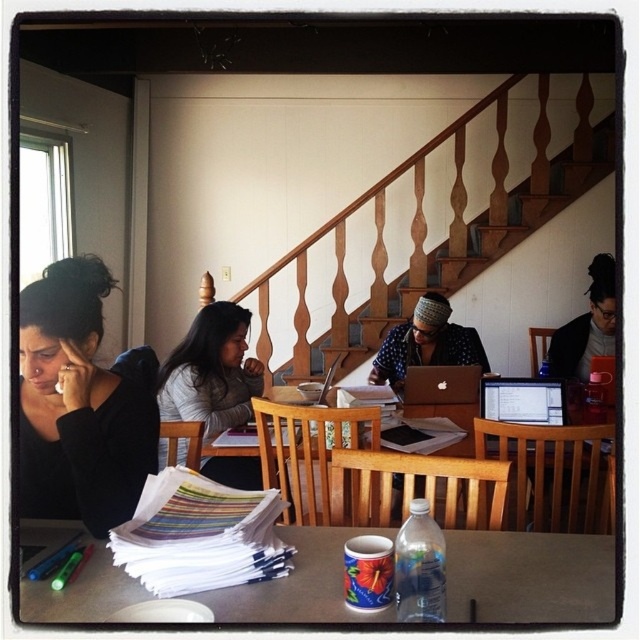
Question: Does wooden stairs at upper center appear over matte gray sweater at center?

Choices:
 (A) no
 (B) yes

Answer: (B)

Question: Does wooden table at center have a lesser width compared to polka dot shirt at center?

Choices:
 (A) no
 (B) yes

Answer: (A)

Question: Which is farther from the wooden stairs at upper center?

Choices:
 (A) black matte shirt at left
 (B) wooden table at center
 (C) smooth brown table at lower center
 (D) polka dot shirt at center

Answer: (A)

Question: Estimate the real-world distances between objects in this image. Which object is closer to the wooden stairs at upper center?

Choices:
 (A) polka dot shirt at center
 (B) matte gray sweater at center
 (C) black matte shirt at left
 (D) smooth brown table at lower center

Answer: (A)

Question: Can you confirm if smooth brown table at lower center is bigger than polka dot shirt at center?

Choices:
 (A) no
 (B) yes

Answer: (A)

Question: Which of the following is the closest to the observer?

Choices:
 (A) smooth brown table at lower center
 (B) wooden table at center
 (C) wooden stairs at upper center
 (D) black matte shirt at left

Answer: (A)